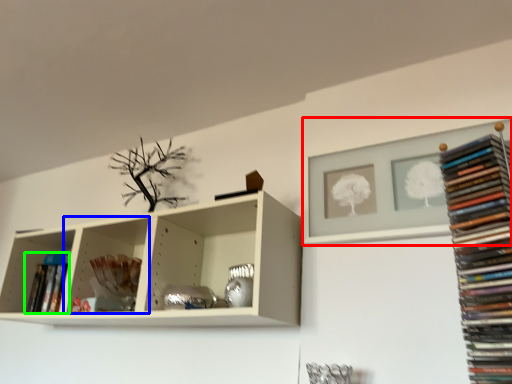
Question: Which object is the farthest from shelf (highlighted by a red box)? Choose among these: shelf (highlighted by a blue box) or book (highlighted by a green box).

Choices:
 (A) shelf
 (B) book

Answer: (B)